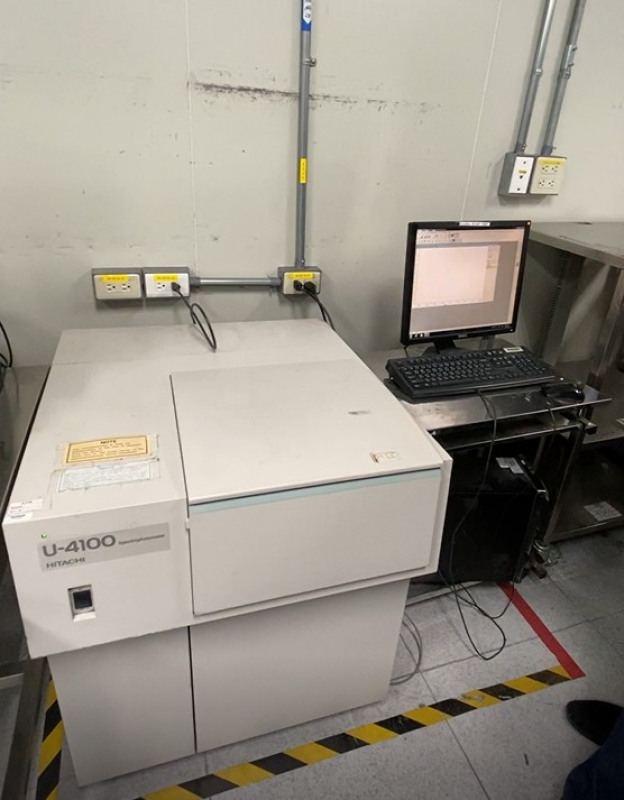
This screenshot has height=800, width=624. In order to click on wall in this screenshot , I will do pyautogui.click(x=367, y=126).